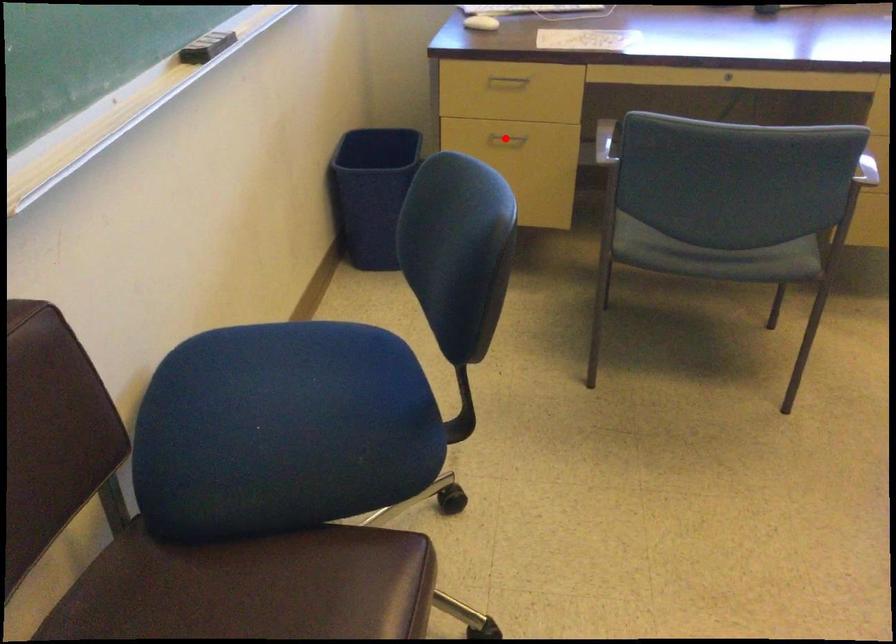
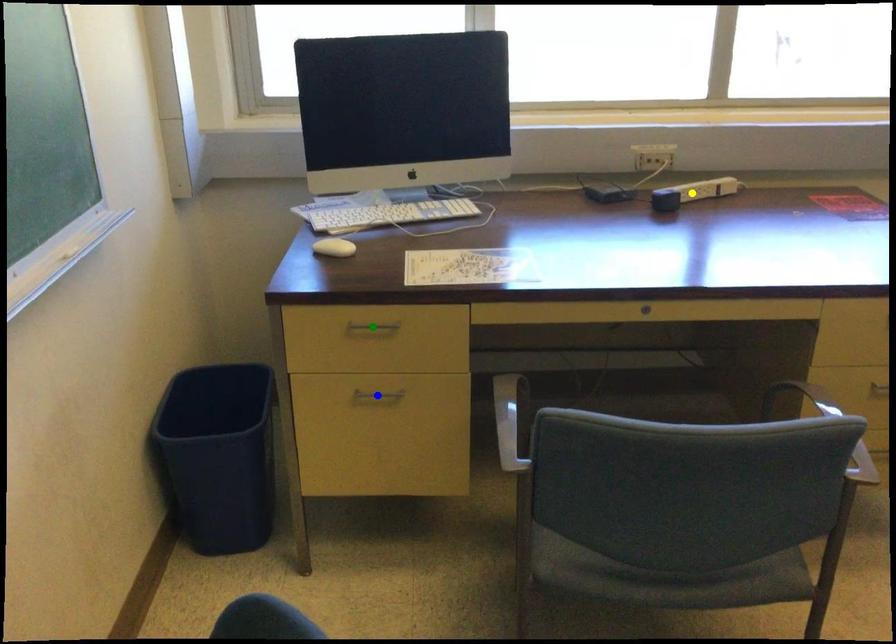
Question: I am providing you with two images of the same scene from different viewpoints. A red point is marked on the first image. You are given multiple points on the second image. Which point in image 2 is actually the same real-world point as the red point in image 1?

Choices:
 (A) green point
 (B) yellow point
 (C) blue point

Answer: (C)